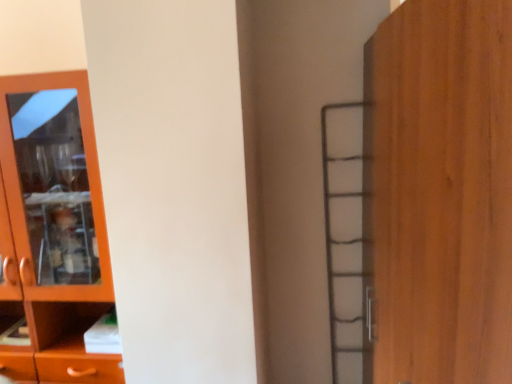
Question: Does matte wood cupboard at left turn towards wooden door at right?

Choices:
 (A) yes
 (B) no

Answer: (B)

Question: Is matte wood cupboard at left smaller than wooden door at right?

Choices:
 (A) yes
 (B) no

Answer: (A)

Question: From a real-world perspective, is matte wood cupboard at left below wooden door at right?

Choices:
 (A) no
 (B) yes

Answer: (B)

Question: Is matte wood cupboard at left shorter than wooden door at right?

Choices:
 (A) no
 (B) yes

Answer: (A)

Question: Is matte wood cupboard at left turned away from wooden door at right?

Choices:
 (A) yes
 (B) no

Answer: (B)

Question: From a real-world perspective, is matte wood cupboard at left located higher than wooden door at right?

Choices:
 (A) no
 (B) yes

Answer: (A)

Question: Does wooden door at right have a greater width compared to matte wood cupboard at left?

Choices:
 (A) yes
 (B) no

Answer: (A)

Question: Is wooden door at right closer to camera compared to matte wood cupboard at left?

Choices:
 (A) no
 (B) yes

Answer: (B)

Question: Is wooden door at right oriented towards matte wood cupboard at left?

Choices:
 (A) yes
 (B) no

Answer: (A)

Question: Considering the relative sizes of wooden door at right and matte wood cupboard at left in the image provided, is wooden door at right smaller than matte wood cupboard at left?

Choices:
 (A) no
 (B) yes

Answer: (A)

Question: Is wooden door at right not inside matte wood cupboard at left?

Choices:
 (A) no
 (B) yes

Answer: (B)

Question: Does wooden door at right appear on the left side of matte wood cupboard at left?

Choices:
 (A) yes
 (B) no

Answer: (B)

Question: Would you say matte wood cupboard at left is to the left or to the right of wooden door at right in the picture?

Choices:
 (A) right
 (B) left

Answer: (B)